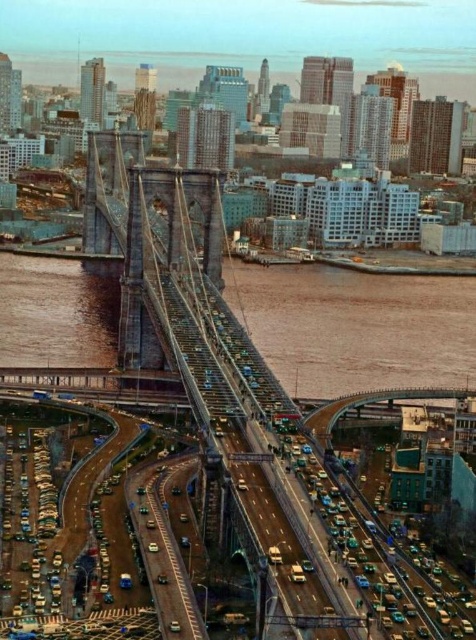
Does gray metallic suspension bridge at center have a greater height compared to brown water at center?

Correct, gray metallic suspension bridge at center is much taller as brown water at center.

Can you confirm if gray metallic suspension bridge at center is thinner than brown water at center?

Yes, gray metallic suspension bridge at center is thinner than brown water at center.

Identify the location of gray metallic suspension bridge at center. The width and height of the screenshot is (476, 640). (258, 422).